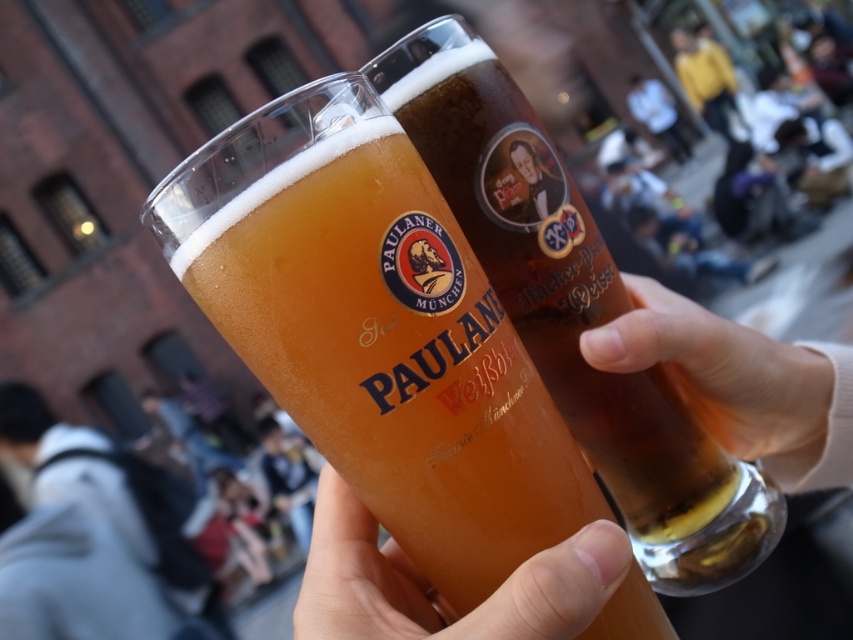
Question: Estimate the real-world distances between objects in this image. Which object is closer to the translucent glass at center?

Choices:
 (A) translucent glass beer glass at center
 (B) translucent glass mug at center

Answer: (A)

Question: Does translucent glass beer glass at center appear under translucent glass mug at center?

Choices:
 (A) yes
 (B) no

Answer: (A)

Question: Which point is farther from the camera taking this photo?

Choices:
 (A) (711, 392)
 (B) (556, 378)

Answer: (A)

Question: Is translucent glass mug at center thinner than translucent glass at center?

Choices:
 (A) yes
 (B) no

Answer: (B)

Question: Which point is farther to the camera?

Choices:
 (A) pink fabric at lower right
 (B) translucent glass mug at center
 (C) translucent glass at center
 (D) translucent glass beer glass at center

Answer: (B)

Question: Does translucent glass at center have a greater width compared to pink fabric at lower right?

Choices:
 (A) yes
 (B) no

Answer: (B)